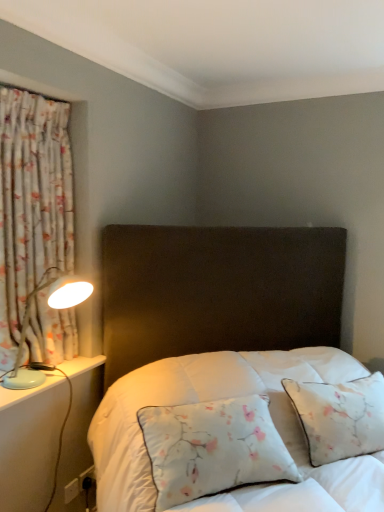
Question: From a real-world perspective, is floral fabric curtain at left positioned above or below white plastic electric outlet at lower left?

Choices:
 (A) above
 (B) below

Answer: (A)

Question: Is point (36, 337) positioned closer to the camera than point (71, 495)?

Choices:
 (A) farther
 (B) closer

Answer: (B)

Question: Which object is positioned closest to the light blue plastic table lamp at left?

Choices:
 (A) floral fabric curtain at left
 (B) floral fabric pillow at center
 (C) white plastic electric outlet at lower left

Answer: (A)

Question: Considering the real-world distances, which object is farthest from the white plastic electric outlet at lower left?

Choices:
 (A) light blue plastic table lamp at left
 (B) floral fabric curtain at left
 (C) floral fabric pillow at center

Answer: (B)